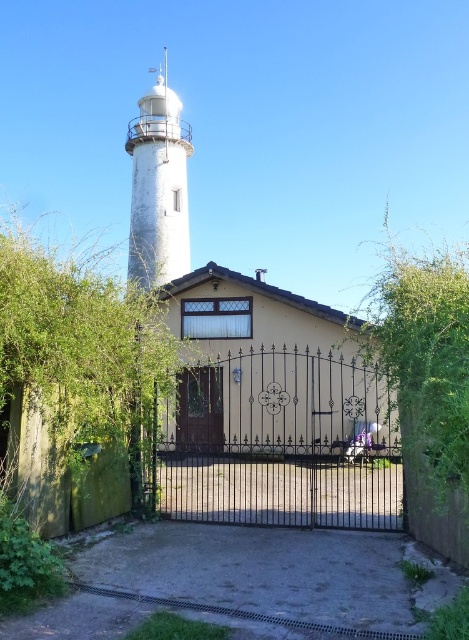
Which is in front, point (204, 433) or point (167, 244)?

Point (204, 433) is more forward.

What do you see at coordinates (280, 444) in the screenshot?
I see `black wrought iron gate at center` at bounding box center [280, 444].

Where is `black wrought iron gate at center`? This screenshot has width=469, height=640. black wrought iron gate at center is located at coordinates (280, 444).

Who is shorter, black wrought iron gate at center or brown wooden door at center?

brown wooden door at center

Is black wrought iron gate at center wider than brown wooden door at center?

Yes.

Identify the location of black wrought iron gate at center. This screenshot has height=640, width=469. 280,444.

In the scene shown: Does white matte/light tower at upper left have a greater width compared to brown wooden door at center?

Yes, white matte/light tower at upper left is wider than brown wooden door at center.

Who is more forward, (171, 182) or (188, 378)?

Point (188, 378) is more forward.

The image size is (469, 640). What are the coordinates of `white matte/light tower at upper left` in the screenshot? It's located at (158, 186).